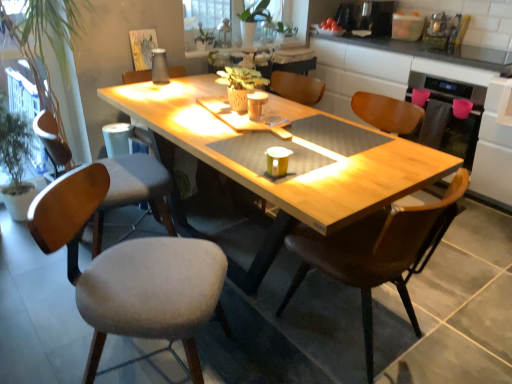
Identify the location of vacant space in front of matte brown coffee cup at center, placed as the first coffee cup when sorted from back to front. (257, 125).